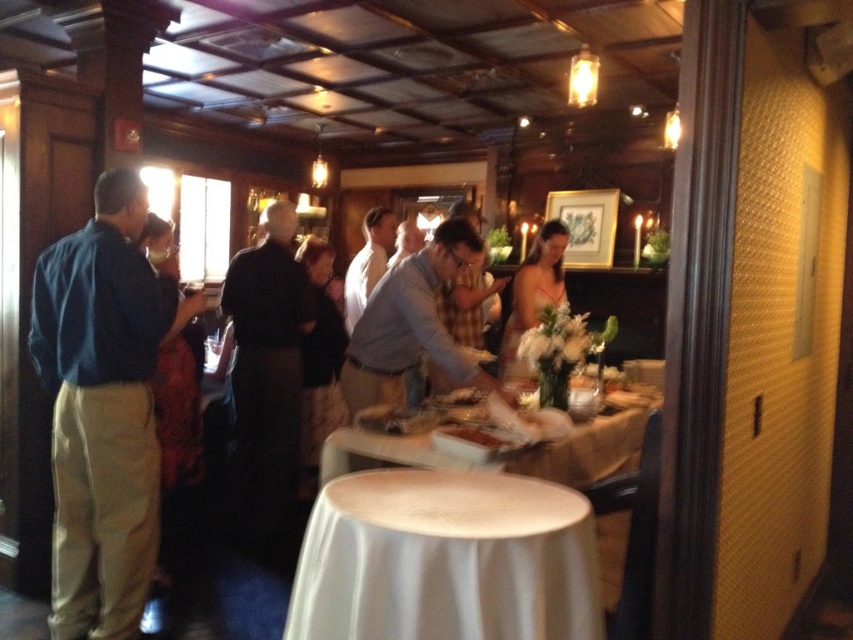
Question: Can you confirm if blue shirt at left is bigger than white cloth at lower center?

Choices:
 (A) no
 (B) yes

Answer: (B)

Question: Estimate the real-world distances between objects in this image. Which object is closer to the blue shirt at left?

Choices:
 (A) white cloth table at center
 (B) matte orange dress at center
 (C) white cloth at lower center
 (D) black matte shirt at center

Answer: (D)

Question: Does black matte shirt at center appear over white cloth table at center?

Choices:
 (A) no
 (B) yes

Answer: (B)

Question: From the image, what is the correct spatial relationship of white cloth at lower center in relation to black matte shirt at center?

Choices:
 (A) above
 (B) below

Answer: (B)

Question: Which point is closer to the camera?

Choices:
 (A) (120, 420)
 (B) (578, 472)

Answer: (A)

Question: Which point appears closest to the camera in this image?

Choices:
 (A) (560, 618)
 (B) (538, 275)
 (C) (149, 344)

Answer: (A)